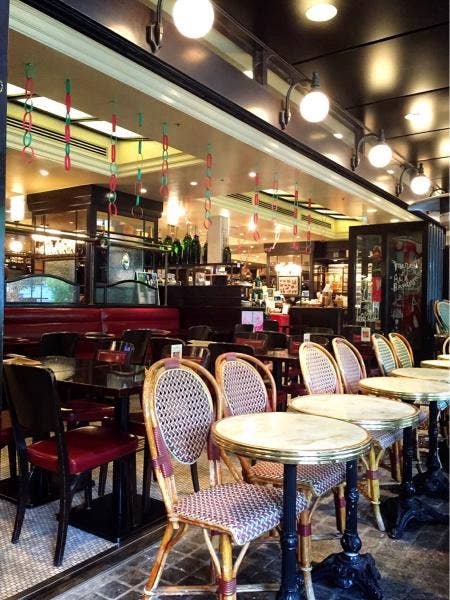
I want to click on tables in first row, so click(x=311, y=456), click(x=400, y=425), click(x=438, y=399), click(x=447, y=377), click(x=443, y=361), click(x=444, y=354).